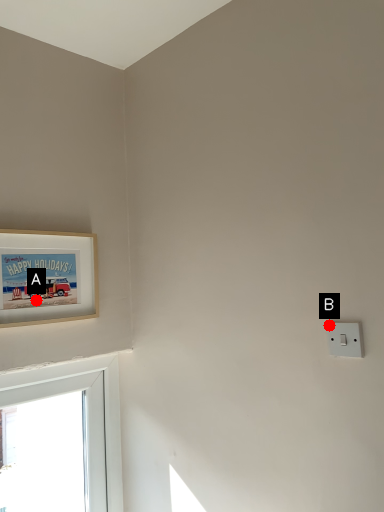
Question: Two points are circled on the image, labeled by A and B beside each circle. Which point is closer to the camera taking this photo?

Choices:
 (A) A is closer
 (B) B is closer

Answer: (B)